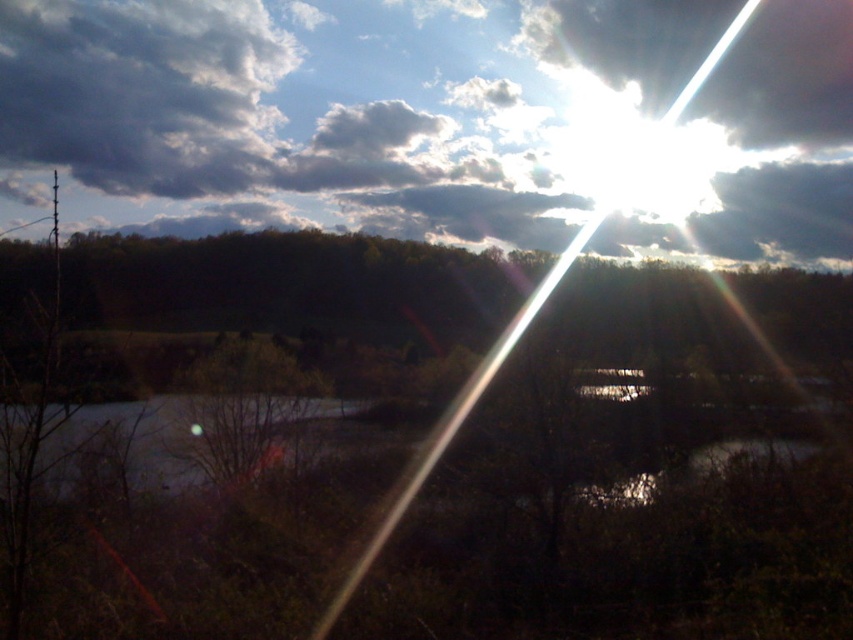
You are an outdoor photographer trying to capture the reflection of the sun in the smooth gray water at center. However, there is a brown matte tree at center blocking your view. Can you still see the reflection of the sun in the water?

The smooth gray water at center is behind the brown matte tree at center, so the tree is blocking the view of the water. Therefore, you cannot see the reflection of the sun in the smooth gray water at center.

You are an observer standing on the shore looking out at the scene. Which object is positioned higher in the visual field between the cloudy sky at upper center and the smooth gray water at center?

The cloudy sky at upper center is positioned above the smooth gray water at center, so it is higher in the visual field.